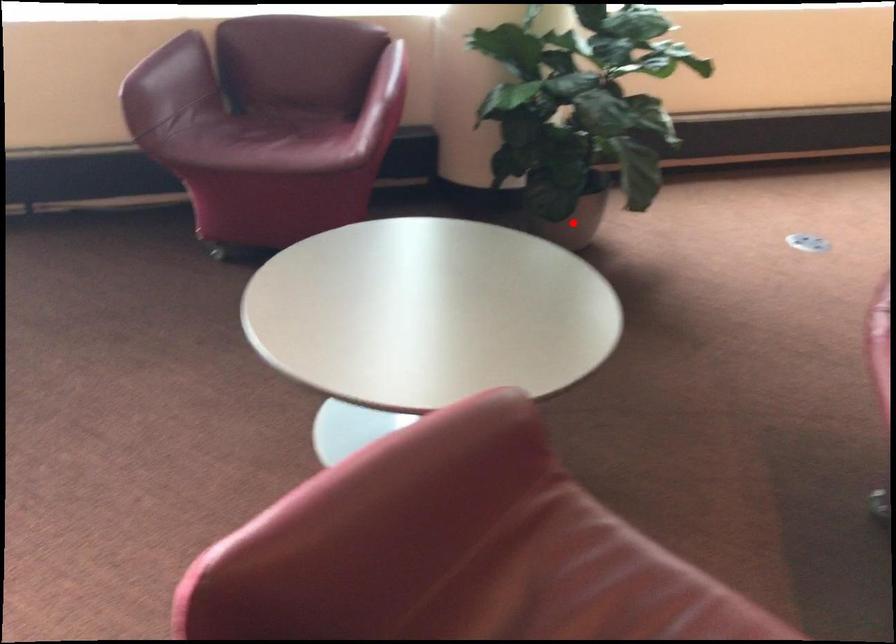
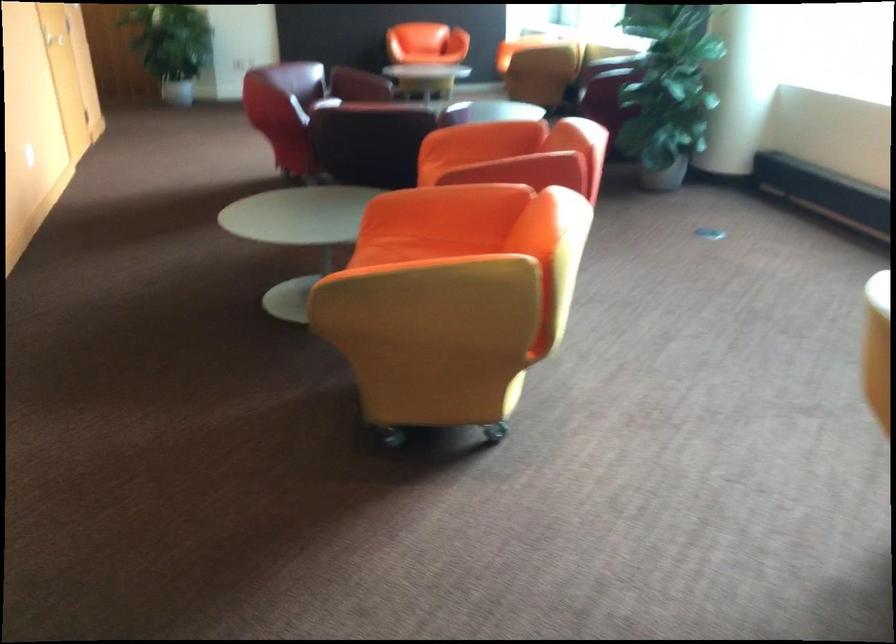
Question: A red point is marked in image1. In image2, is the corresponding 3D point closer to the camera or farther? Reply with the corresponding letter.

Choices:
 (A) The corresponding 3D point is closer.
 (B) The corresponding 3D point is farther.

Answer: (B)